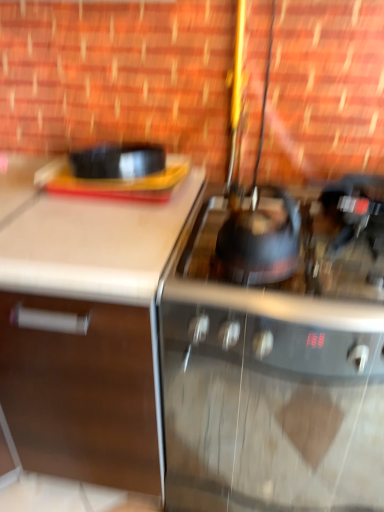
Locate an element on the screen. free point in front of shiny black kettle at center is located at coordinates (273, 287).